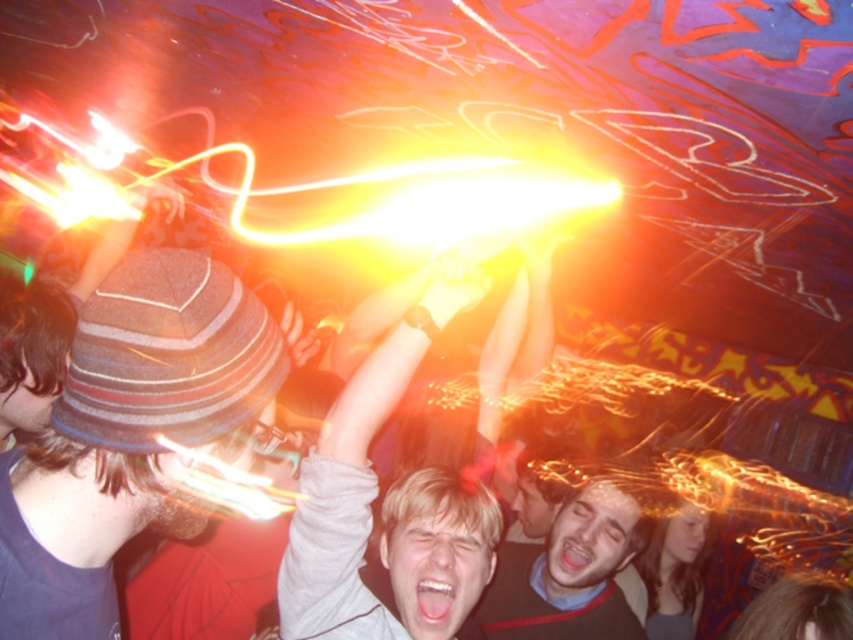
You are at a party and want to take a photo of both the striped wool hat at left and the smooth gray shirt at center. Which object should you zoom in on to ensure both fit in the frame?

The striped wool hat at left is smaller than the smooth gray shirt at center. To ensure both fit in the frame, you should zoom out slightly so that the larger smooth gray shirt at center doesn

You are a photographer at the event and want to capture a photo that includes both the striped wool hat at left and the smooth gray shirt at center. The camera you are using has a maximum focus range of 24 inches. Will both subjects be in focus?

The distance between the striped wool hat at left and the smooth gray shirt at center is 23.91 inches, which is within the camera maximum focus range of 24 inches. Therefore, both subjects will be in focus.

You are at a party and see the striped wool hat at left and the smooth gray shirt at center. Which object is covering the other?

The striped wool hat at left is positioned over the smooth gray shirt at center, so it is covering the other.